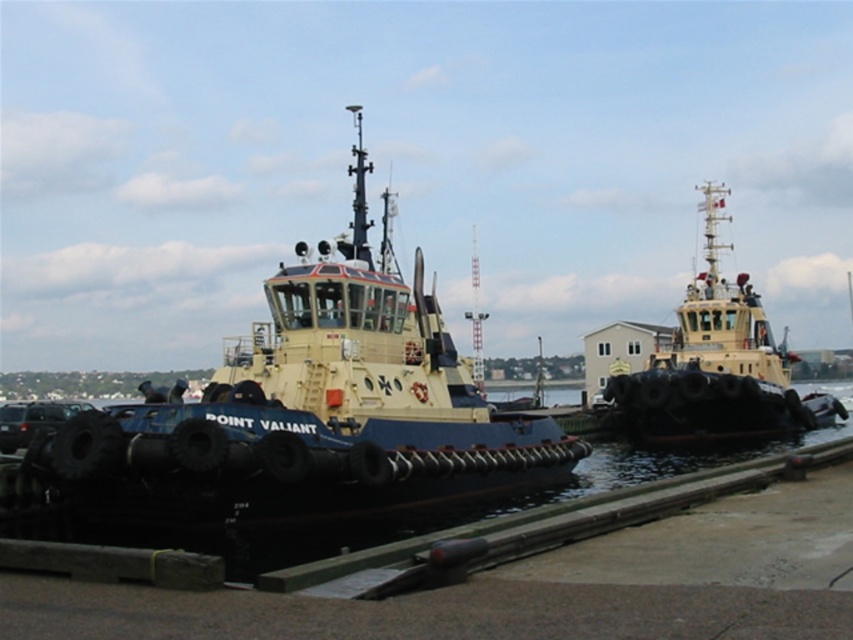
Measure the distance between yellow matte tugboat at center and camera.

14.15 meters

Who is shorter, yellow matte tugboat at center or yellow matte tugboat at upper right?

Standing shorter between the two is yellow matte tugboat at center.

Between point (287, 292) and point (683, 362), which one is positioned behind?

The point (683, 362) is behind.

Where is `yellow matte tugboat at center`? This screenshot has width=853, height=640. yellow matte tugboat at center is located at coordinates (300, 413).